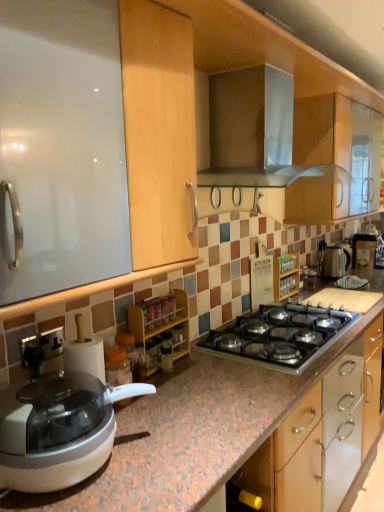
Question: Considering the relative sizes of metallic silver coffee machine at right and wooden spice rack at center, the 1th cabinetry in the left-to-right sequence, in the image provided, is metallic silver coffee machine at right wider than wooden spice rack at center, the 1th cabinetry in the left-to-right sequence,?

Choices:
 (A) yes
 (B) no

Answer: (A)

Question: Could wooden spice rack at center, acting as the second cabinetry starting from the right, be considered to be inside metallic silver coffee machine at right?

Choices:
 (A) no
 (B) yes

Answer: (A)

Question: Is metallic silver coffee machine at right taller than wooden spice rack at center, the 2th cabinetry when ordered from back to front?

Choices:
 (A) yes
 (B) no

Answer: (B)

Question: From the image's perspective, is metallic silver coffee machine at right located beneath wooden spice rack at center, acting as the second cabinetry starting from the right?

Choices:
 (A) no
 (B) yes

Answer: (A)

Question: Can you confirm if metallic silver coffee machine at right is positioned to the right of wooden spice rack at center, acting as the second cabinetry starting from the right?

Choices:
 (A) yes
 (B) no

Answer: (A)

Question: Does metallic silver coffee machine at right have a lesser height compared to wooden spice rack at center, acting as the second cabinetry starting from the right?

Choices:
 (A) no
 (B) yes

Answer: (B)

Question: Is white plastic food processor at lower left in front of satin silver kettle at right, the second kitchen appliance viewed from the left?

Choices:
 (A) no
 (B) yes

Answer: (B)

Question: Can you confirm if white plastic food processor at lower left is taller than satin silver kettle at right, which is counted as the second kitchen appliance, starting from the front?

Choices:
 (A) no
 (B) yes

Answer: (A)

Question: Is white plastic food processor at lower left placed right next to satin silver kettle at right, the second kitchen appliance viewed from the left?

Choices:
 (A) no
 (B) yes

Answer: (A)

Question: From the image's perspective, is white plastic food processor at lower left below satin silver kettle at right, marked as the first kitchen appliance in a right-to-left arrangement?

Choices:
 (A) no
 (B) yes

Answer: (B)

Question: Does white plastic food processor at lower left have a lesser height compared to satin silver kettle at right, acting as the first kitchen appliance starting from the back?

Choices:
 (A) no
 (B) yes

Answer: (B)

Question: From a real-world perspective, is white plastic food processor at lower left physically above satin silver kettle at right, arranged as the 1th kitchen appliance when ordered from the bottom?

Choices:
 (A) no
 (B) yes

Answer: (A)

Question: Is metallic silver range hood at upper center, which is the second kitchen appliance in right-to-left order, turned away from white plastic food processor at lower left?

Choices:
 (A) no
 (B) yes

Answer: (A)